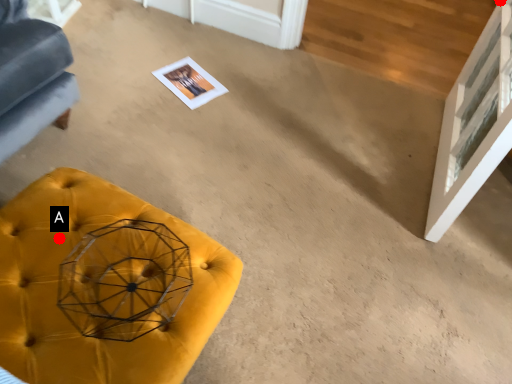
Question: Two points are circled on the image, labeled by A and B beside each circle. Which point appears closest to the camera in this image?

Choices:
 (A) A is closer
 (B) B is closer

Answer: (A)